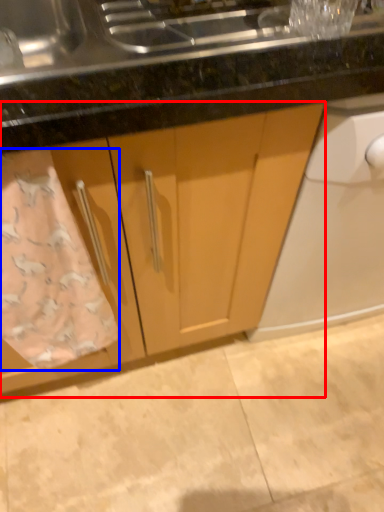
Question: Which of the following is the farthest to the observer, cabinetry (highlighted by a red box) or bath towel (highlighted by a blue box)?

Choices:
 (A) cabinetry
 (B) bath towel

Answer: (B)